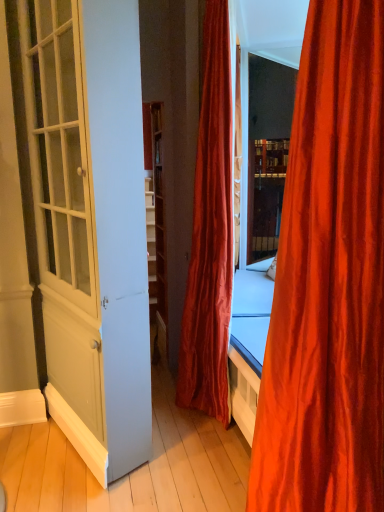
Find the location of `free space in front of white glossy door at left`. free space in front of white glossy door at left is located at coordinates (71, 485).